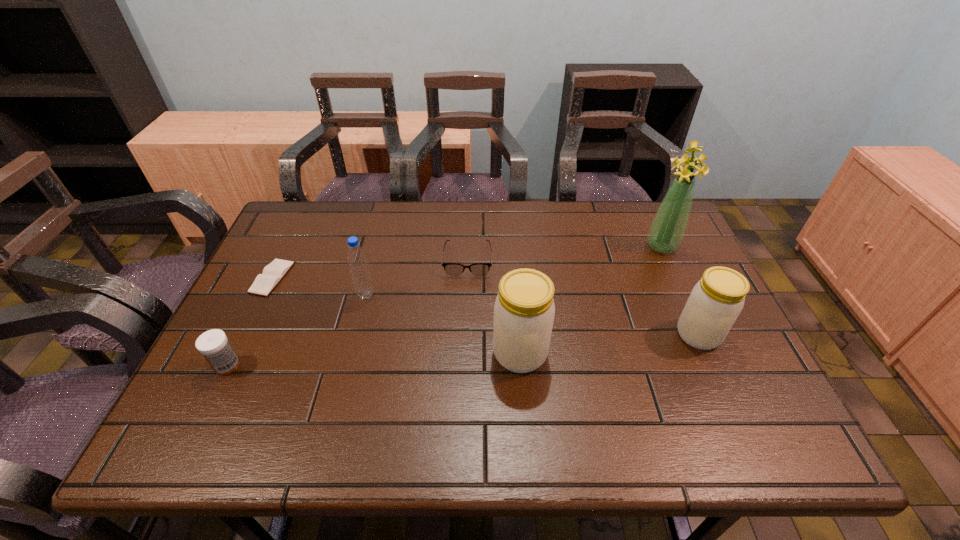
I want to click on jar situated at the right edge, so click(716, 301).

Identify the location of bouquet present at the right edge. (667, 230).

Identify the location of object that is at the near left corner. The image size is (960, 540). click(213, 344).

I want to click on object at the far right corner, so click(667, 230).

Locate an element on the screen. The height and width of the screenshot is (540, 960). vacant region at the far edge of the desktop is located at coordinates (495, 232).

In the image, there is a desktop. Identify the location of vacant space at the near edge. The height and width of the screenshot is (540, 960). (512, 377).

The image size is (960, 540). In the image, there is a desktop. In order to click on vacant space at the left edge in this screenshot , I will do click(233, 311).

In the image, there is a desktop. Where is `free space at the right edge`? This screenshot has height=540, width=960. free space at the right edge is located at coordinates (662, 257).

Locate an element on the screen. This screenshot has height=540, width=960. free space at the far left corner is located at coordinates (307, 200).

Image resolution: width=960 pixels, height=540 pixels. I want to click on vacant position at the near left corner of the desktop, so click(x=211, y=402).